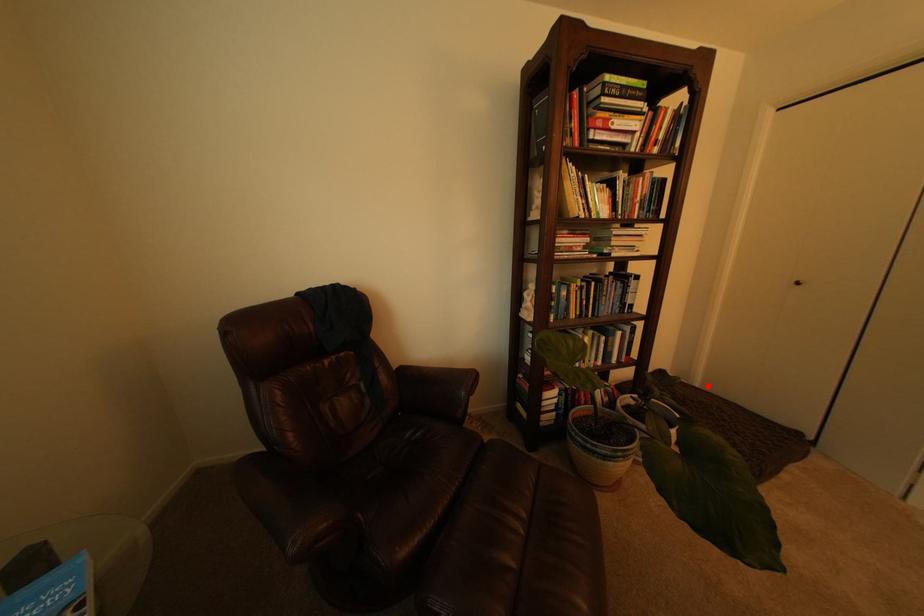
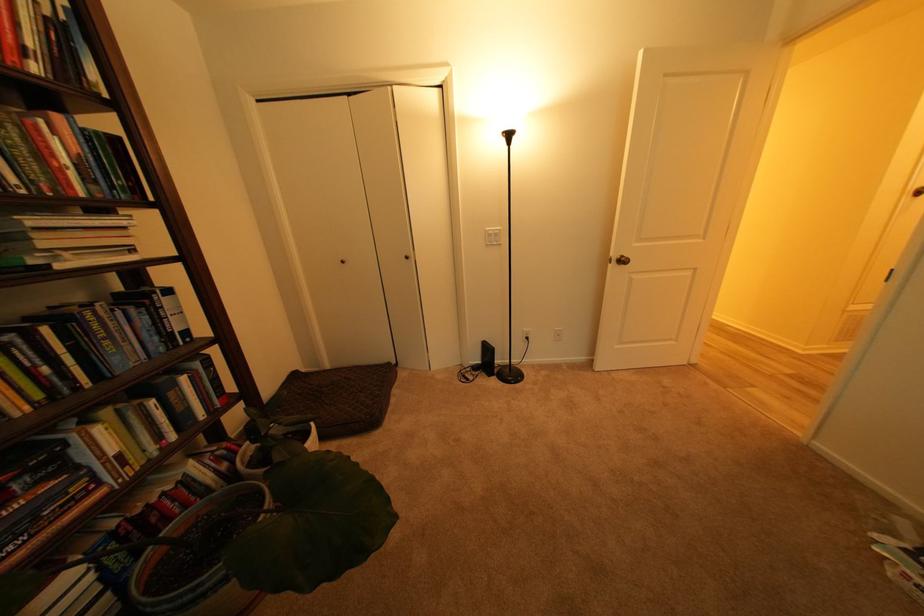
Where in the second image is the point corresponding to the highlighted location from the first image?

(338, 368)